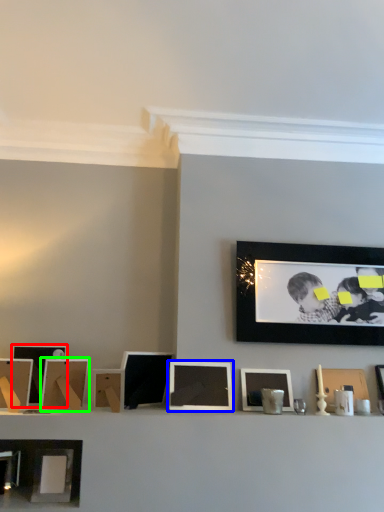
Question: Which object is the closest to the picture frame (highlighted by a red box)? Choose among these: picture frame (highlighted by a blue box) or picture frame (highlighted by a green box).

Choices:
 (A) picture frame
 (B) picture frame

Answer: (B)